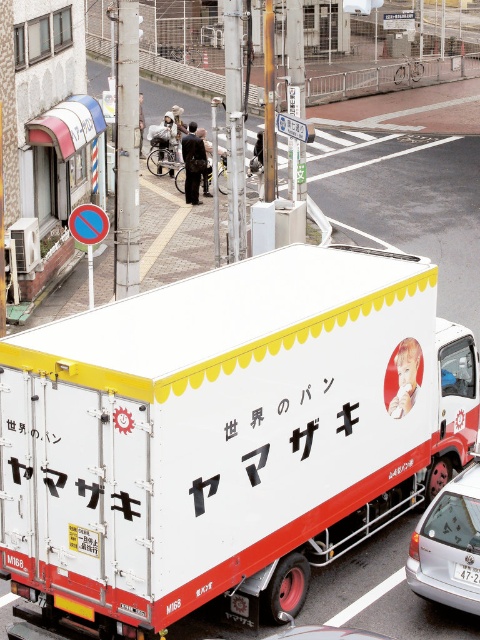
Which is more to the right, whitematerial/texture at right or white plastic license plate at lower right?

Positioned to the right is white plastic license plate at lower right.

Is point (197, 488) positioned behind point (468, 579)?

No, (197, 488) is in front of (468, 579).

Does point (252, 419) come farther from viewer compared to point (472, 580)?

No.

Locate an element on the screen. The height and width of the screenshot is (640, 480). whitematerial/texture at right is located at coordinates (203, 492).

Consider the image. Can you confirm if silver metallic sedan at lower right is positioned to the left of whitematerial/texture at right?

No, silver metallic sedan at lower right is not to the left of whitematerial/texture at right.

Who is positioned more to the left, silver metallic sedan at lower right or whitematerial/texture at right?

whitematerial/texture at right is more to the left.

Who is more forward, (411, 547) or (229, 429)?

Point (229, 429) is in front.

Locate an element on the screen. silver metallic sedan at lower right is located at coordinates (448, 545).

Who is positioned more to the right, white matte trailer truck at center or silver metallic sedan at lower right?

From the viewer's perspective, silver metallic sedan at lower right appears more on the right side.

Describe the element at coordinates (227, 435) in the screenshot. The width and height of the screenshot is (480, 640). I see `white matte trailer truck at center` at that location.

Image resolution: width=480 pixels, height=640 pixels. I want to click on white matte trailer truck at center, so click(x=227, y=435).